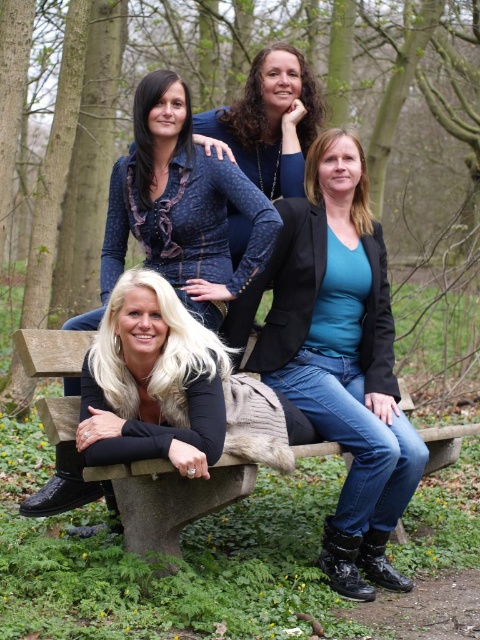
You are a photographer setting up a shot of the scene. You notice the teal matte blazer at center and the concrete bench at center. Which object is covering the other?

The teal matte blazer at center is positioned over the concrete bench at center, so it is covering the bench.

You are a photographer trying to capture a group photo of the women on the teal matte blazer at center and the concrete bench at center. Since you want to ensure both objects are clearly visible, which object should you focus on first considering their sizes?

The teal matte blazer at center has a larger size compared to the concrete bench at center, so you should focus on the teal matte blazer at center first to ensure its details are sharp before adjusting for the concrete bench at center.